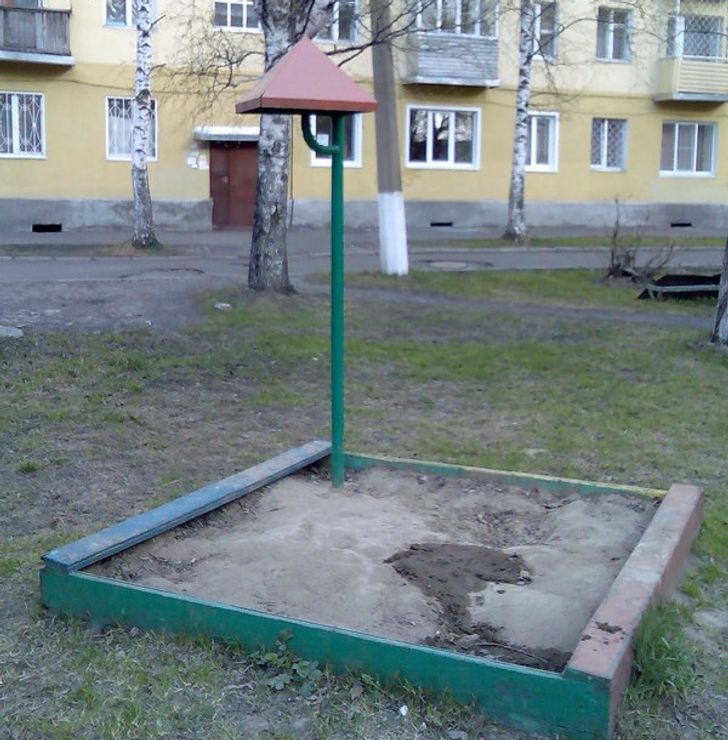
At what (x,y) coordinates should I click in order to perform the action: click on window. Please return your answer as a coordinate pair (x, y). The image size is (728, 740). Looking at the image, I should click on (462, 149).